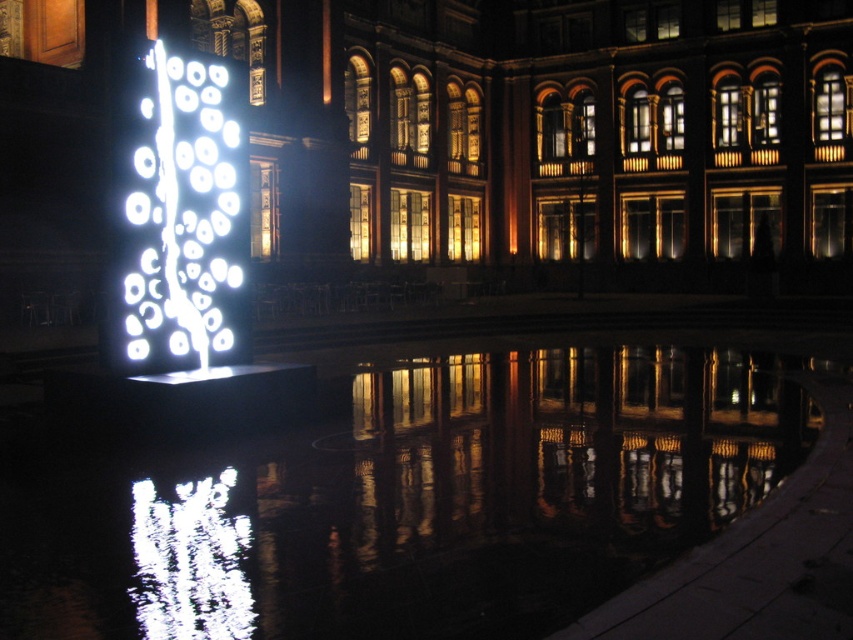
Does transparent liquid water at center appear over white glossy water at lower left?

Correct, transparent liquid water at center is located above white glossy water at lower left.

Which is in front, point (421, 582) or point (149, 579)?

Point (149, 579) is more forward.

I want to click on transparent liquid water at center, so click(x=410, y=499).

Which of these two, white glossy neon light at left or white glossy water at lower left, stands shorter?

white glossy water at lower left

Is point (206, 321) behind point (215, 490)?

Yes, point (206, 321) is behind point (215, 490).

Does point (166, 320) lie in front of point (210, 586)?

That is False.

You are a GUI agent. You are given a task and a screenshot of the screen. Output one action in this format:
    pyautogui.click(x=<x>, y=<y>)
    Task: Click on the white glossy neon light at left
    The width and height of the screenshot is (853, 640).
    Given the screenshot: What is the action you would take?
    pyautogui.click(x=184, y=221)

What do you see at coordinates (410, 499) in the screenshot?
I see `transparent liquid water at center` at bounding box center [410, 499].

Which is in front, point (625, 412) or point (183, 252)?

Point (183, 252) is more forward.

Locate an element on the screen. The height and width of the screenshot is (640, 853). transparent liquid water at center is located at coordinates (410, 499).